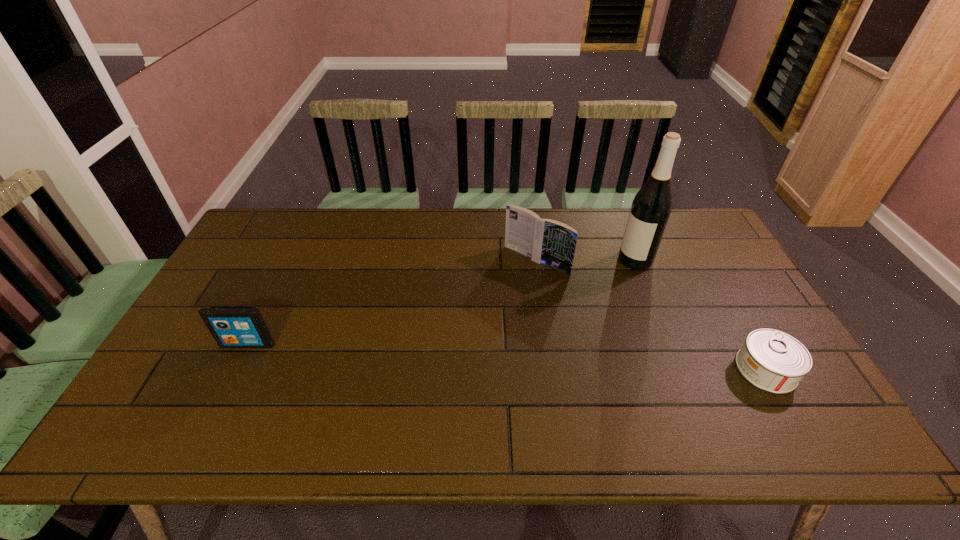
Locate an element on the screen. The height and width of the screenshot is (540, 960). free spot between the tallest object and the leftmost object is located at coordinates 442,302.

Find the location of `vacant space in between the iPod and the shortest object`. vacant space in between the iPod and the shortest object is located at coordinates (507, 356).

Image resolution: width=960 pixels, height=540 pixels. Identify the location of free spot between the third object from right to left and the wine bottle. (586, 261).

The height and width of the screenshot is (540, 960). I want to click on free point between the shortest object and the tallest object, so click(x=701, y=315).

The height and width of the screenshot is (540, 960). I want to click on empty space that is in between the book and the shortest object, so click(x=651, y=315).

What are the coordinates of `free space between the third shortest object and the can` in the screenshot? It's located at (651, 315).

Locate which object is the second closest to the rightmost object. Please provide its 2D coordinates. Your answer should be formatted as a tuple, i.e. [(x, y)], where the tuple contains the x and y coordinates of a point satisfying the conditions above.

[(544, 241)]

Identify which object is the third nearest to the tallest object. Please provide its 2D coordinates. Your answer should be formatted as a tuple, i.e. [(x, y)], where the tuple contains the x and y coordinates of a point satisfying the conditions above.

[(231, 326)]

Identify the location of vacant area in the image that satisfies the following two spatial constraints: 1. on the front screen of the can; 2. on the left side of the iPod. (236, 369).

This screenshot has width=960, height=540. What are the coordinates of `free location that satisfies the following two spatial constraints: 1. on the front side of the third object from right to left; 2. on the left side of the can` in the screenshot? It's located at (551, 369).